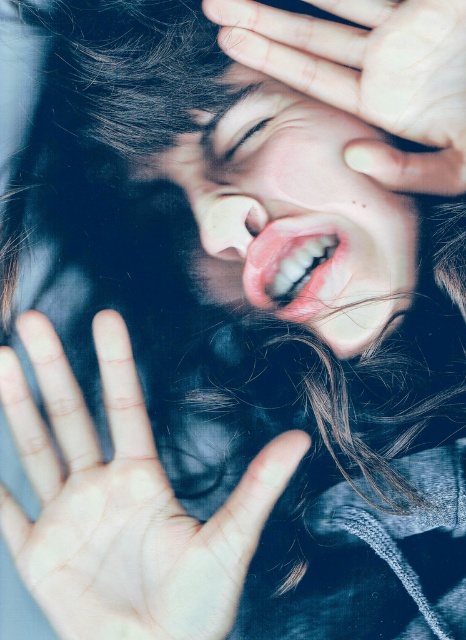
Question: Which point is closer to the camera taking this photo?

Choices:
 (A) (226, 148)
 (B) (171, 534)
 (C) (251, 257)

Answer: (B)

Question: Does smooth skin face at center have a lesser width compared to matte skin at center?

Choices:
 (A) no
 (B) yes

Answer: (A)

Question: Is pale skin/hair at center wider than pink glossy lips at center?

Choices:
 (A) yes
 (B) no

Answer: (A)

Question: Estimate the real-world distances between objects in this image. Which object is closer to the smooth skin hand at upper center?

Choices:
 (A) pink glossy lips at center
 (B) matte skin at center
 (C) pale skin/hair at center
 (D) smooth skin face at center

Answer: (D)

Question: Which of the following is the closest to the observer?

Choices:
 (A) (328, 96)
 (B) (233, 102)
 (C) (129, 465)
 (D) (279, 250)

Answer: (C)

Question: Is pale skin/hair at center above matte skin at center?

Choices:
 (A) no
 (B) yes

Answer: (A)